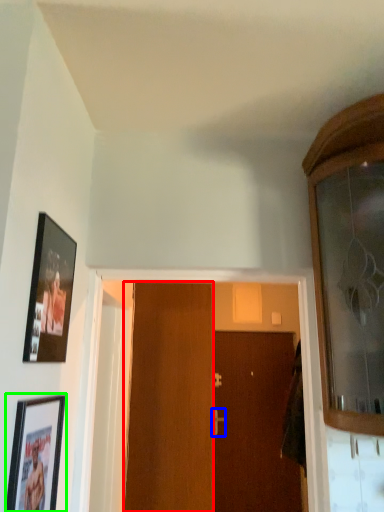
Question: Which is nearer to the door (highlighted by a red box)? door handle (highlighted by a blue box) or picture frame (highlighted by a green box).

Choices:
 (A) door handle
 (B) picture frame

Answer: (B)